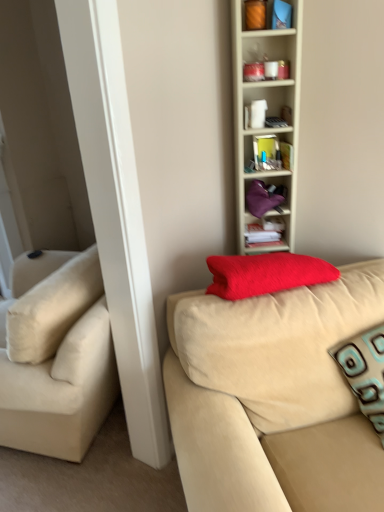
At what (x,y) coordinates should I click in order to perform the action: click on velvet beige couch at center. Please return your answer as a coordinate pair (x, y). The image size is (384, 512). Looking at the image, I should click on (273, 398).

The height and width of the screenshot is (512, 384). Describe the element at coordinates (264, 197) in the screenshot. I see `purple fabric bag at upper center, the 1th cabinet from the back` at that location.

At what (x,y) coordinates should I click in order to perform the action: click on wooden bookshelf at upper right. Please return your answer as a coordinate pair (x, y). The height and width of the screenshot is (512, 384). Looking at the image, I should click on (266, 113).

Where is `orange matte candle at upper center, acting as the first cabinet starting from the top`? The width and height of the screenshot is (384, 512). orange matte candle at upper center, acting as the first cabinet starting from the top is located at coordinates (267, 15).

The height and width of the screenshot is (512, 384). I want to click on velvet beige couch at center, so click(x=273, y=398).

From a real-world perspective, which is physically above, white paper stack at upper center or orange matte candle at upper center, acting as the first cabinet starting from the top?

orange matte candle at upper center, acting as the first cabinet starting from the top, from a real-world perspective.

Is orange matte candle at upper center, marked as the 2th cabinet in a bottom-to-top arrangement, at the back of white paper stack at upper center?

That's not correct — white paper stack at upper center is not looking away from orange matte candle at upper center, marked as the 2th cabinet in a bottom-to-top arrangement.

Looking at the image, does white paper stack at upper center seem bigger or smaller compared to orange matte candle at upper center, positioned as the 1th cabinet in front-to-back order?

In the image, white paper stack at upper center appears to be larger than orange matte candle at upper center, positioned as the 1th cabinet in front-to-back order.

Is white paper stack at upper center taller than orange matte candle at upper center, positioned as the 1th cabinet in front-to-back order?

Incorrect, the height of white paper stack at upper center is not larger of that of orange matte candle at upper center, positioned as the 1th cabinet in front-to-back order.

Is white paper stack at upper center turned away from teal patterned pillow at right?

white paper stack at upper center is not turned away from teal patterned pillow at right.

Is point (256, 228) farther from camera compared to point (379, 392)?

Yes.

Can you confirm if white paper stack at upper center is positioned to the right of teal patterned pillow at right?

No.

Considering the sizes of white paper stack at upper center and teal patterned pillow at right in the image, is white paper stack at upper center wider or thinner than teal patterned pillow at right?

white paper stack at upper center is thinner than teal patterned pillow at right.

Can you confirm if purple fabric bag at upper center, marked as the second cabinet in a top-to-bottom arrangement, is bigger than wooden bookshelf at upper right?

No, purple fabric bag at upper center, marked as the second cabinet in a top-to-bottom arrangement, is not bigger than wooden bookshelf at upper right.

From the image's perspective, which object appears higher, purple fabric bag at upper center, the 1th cabinet from the back, or wooden bookshelf at upper right?

wooden bookshelf at upper right.

Considering the sizes of objects purple fabric bag at upper center, marked as the second cabinet in a top-to-bottom arrangement, and wooden bookshelf at upper right in the image provided, who is shorter, purple fabric bag at upper center, marked as the second cabinet in a top-to-bottom arrangement, or wooden bookshelf at upper right?

purple fabric bag at upper center, marked as the second cabinet in a top-to-bottom arrangement, is shorter.

From a real-world perspective, is purple fabric bag at upper center, acting as the 1th cabinet starting from the bottom, physically above teal patterned pillow at right?

Yes, from a real-world perspective, purple fabric bag at upper center, acting as the 1th cabinet starting from the bottom, is over teal patterned pillow at right

Who is taller, purple fabric bag at upper center, the second cabinet when ordered from front to back, or teal patterned pillow at right?

Standing taller between the two is teal patterned pillow at right.

From the picture: Can you confirm if purple fabric bag at upper center, the 1th cabinet from the back, is positioned to the right of teal patterned pillow at right?

No, purple fabric bag at upper center, the 1th cabinet from the back, is not to the right of teal patterned pillow at right.

Identify the location of pillow below the purple fabric bag at upper center, the 1th cabinet from the back (from a real-world perspective). The height and width of the screenshot is (512, 384). (365, 372).

Consider the image. Which is in front, velvet beige couch at center or white paper stack at upper center?

Positioned in front is velvet beige couch at center.

I want to click on book that appears above the velvet beige couch at center (from the image's perspective), so click(x=263, y=233).

Considering the relative positions of velvet beige couch at center and white paper stack at upper center in the image provided, is velvet beige couch at center to the left of white paper stack at upper center from the viewer's perspective?

In fact, velvet beige couch at center is to the right of white paper stack at upper center.

In the scene shown: From the image's perspective, does white paper stack at upper center appear lower than velvet beige couch at center?

No.

From a real-world perspective, is white paper stack at upper center positioned above or below velvet beige couch at center?

From a real-world perspective, white paper stack at upper center is physically above velvet beige couch at center.

Would you consider white paper stack at upper center to be distant from velvet beige couch at center?

white paper stack at upper center is actually quite close to velvet beige couch at center.

Does point (268, 241) come behind point (303, 381)?

Yes, point (268, 241) is farther from viewer.

Is wooden bookshelf at upper right positioned before teal patterned pillow at right?

No, it is behind teal patterned pillow at right.

From the image's perspective, relative to teal patterned pillow at right, is wooden bookshelf at upper right above or below?

Based on their image positions, wooden bookshelf at upper right is located above teal patterned pillow at right.

Does point (288, 104) appear closer or farther from the camera than point (362, 341)?

Point (288, 104) is farther from the camera than point (362, 341).

Between wooden bookshelf at upper right and teal patterned pillow at right, which one has less height?

With less height is teal patterned pillow at right.

Where is `book behind the orange matte candle at upper center, which ranks as the second cabinet in back-to-front order`? The height and width of the screenshot is (512, 384). book behind the orange matte candle at upper center, which ranks as the second cabinet in back-to-front order is located at coordinates (263, 233).

You are a GUI agent. You are given a task and a screenshot of the screen. Output one action in this format:
    pyautogui.click(x=<x>, y=<y>)
    Task: Click on the book above the teal patterned pillow at right (from the image's perspective)
    
    Given the screenshot: What is the action you would take?
    pyautogui.click(x=263, y=233)

Based on their spatial positions, is orange matte candle at upper center, which ranks as the second cabinet in back-to-front order, or velvet beige couch at center closer to white paper stack at upper center?

Among the two, velvet beige couch at center is located nearer to white paper stack at upper center.

When comparing their distances from velvet beige couch at center, does teal patterned pillow at right or purple fabric bag at upper center, the second cabinet when ordered from front to back, seem closer?

teal patterned pillow at right is closer to velvet beige couch at center.

Considering their positions, is wooden bookshelf at upper right positioned further to teal patterned pillow at right than purple fabric bag at upper center, the second cabinet when ordered from front to back?

wooden bookshelf at upper right.

From the image, which object appears to be nearer to velvet beige couch at center, wooden bookshelf at upper right or orange matte candle at upper center, positioned as the 1th cabinet in front-to-back order?

The object closer to velvet beige couch at center is wooden bookshelf at upper right.

Considering their positions, is velvet beige couch at center positioned further to wooden bookshelf at upper right than teal patterned pillow at right?

teal patterned pillow at right lies further to wooden bookshelf at upper right than the other object.

Looking at the image, which one is located closer to white paper stack at upper center, orange matte candle at upper center, which ranks as the second cabinet in back-to-front order, or purple fabric bag at upper center, marked as the second cabinet in a top-to-bottom arrangement?

Among the two, purple fabric bag at upper center, marked as the second cabinet in a top-to-bottom arrangement, is located nearer to white paper stack at upper center.

Based on their spatial positions, is velvet beige couch at center or wooden bookshelf at upper right closer to orange matte candle at upper center, which ranks as the second cabinet in back-to-front order?

wooden bookshelf at upper right.

Estimate the real-world distances between objects in this image. Which object is further from wooden bookshelf at upper right, teal patterned pillow at right or purple fabric bag at upper center, the 1th cabinet from the back?

teal patterned pillow at right is further to wooden bookshelf at upper right.

Locate an element on the screen. pillow between velvet beige couch at center and purple fabric bag at upper center, the second cabinet when ordered from front to back, in the front-back direction is located at coordinates (365, 372).

This screenshot has height=512, width=384. I want to click on shelf between orange matte candle at upper center, positioned as the 1th cabinet in front-to-back order, and white paper stack at upper center vertically, so click(x=266, y=113).

Identify the location of cabinet between wooden bookshelf at upper right and velvet beige couch at center in the up-down direction. The height and width of the screenshot is (512, 384). (264, 197).

Identify the location of cabinet between wooden bookshelf at upper right and teal patterned pillow at right in the vertical direction. The width and height of the screenshot is (384, 512). (264, 197).